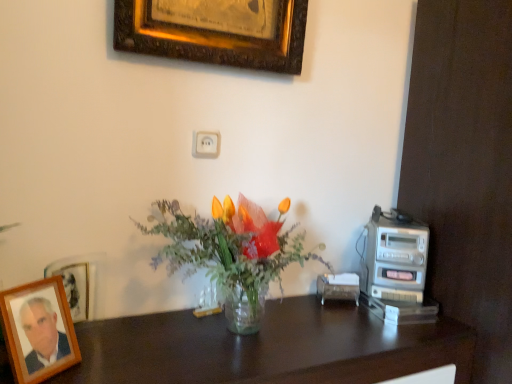
Question: Could you tell me if wooden photo frame at lower left, which is the second picture frame in back-to-front order, is facing gold-framed picture at upper center, the first picture frame positioned from the right?

Choices:
 (A) yes
 (B) no

Answer: (B)

Question: From a real-world perspective, does wooden photo frame at lower left, which is the second picture frame in back-to-front order, sit lower than gold-framed picture at upper center, which appears as the second picture frame when viewed from the left?

Choices:
 (A) yes
 (B) no

Answer: (A)

Question: Is wooden photo frame at lower left, the second picture frame in the right-to-left sequence, with gold-framed picture at upper center, the first picture frame viewed from the back?

Choices:
 (A) no
 (B) yes

Answer: (A)

Question: Is wooden photo frame at lower left, the second picture frame in the top-to-bottom sequence, thinner than gold-framed picture at upper center, which ranks as the second picture frame in front-to-back order?

Choices:
 (A) no
 (B) yes

Answer: (B)

Question: From the image's perspective, is wooden photo frame at lower left, which is the second picture frame in back-to-front order, beneath gold-framed picture at upper center, the first picture frame viewed from the back?

Choices:
 (A) no
 (B) yes

Answer: (B)

Question: Are wooden photo frame at lower left, which is the first picture frame from bottom to top, and gold-framed picture at upper center, the first picture frame viewed from the back, located far from each other?

Choices:
 (A) yes
 (B) no

Answer: (B)

Question: Is silver metallic stereo at right outside of transparent glass vase at center?

Choices:
 (A) yes
 (B) no

Answer: (A)

Question: Does silver metallic stereo at right have a greater height compared to transparent glass vase at center?

Choices:
 (A) no
 (B) yes

Answer: (A)

Question: Is silver metallic stereo at right at the right side of transparent glass vase at center?

Choices:
 (A) yes
 (B) no

Answer: (A)

Question: Is silver metallic stereo at right facing away from transparent glass vase at center?

Choices:
 (A) no
 (B) yes

Answer: (A)

Question: From the image's perspective, is silver metallic stereo at right beneath transparent glass vase at center?

Choices:
 (A) no
 (B) yes

Answer: (B)

Question: Is silver metallic stereo at right thinner than transparent glass vase at center?

Choices:
 (A) yes
 (B) no

Answer: (A)

Question: Is the depth of gold-framed picture at upper center, the first picture frame in the top-to-bottom sequence, greater than that of dark wood desk at center?

Choices:
 (A) yes
 (B) no

Answer: (A)